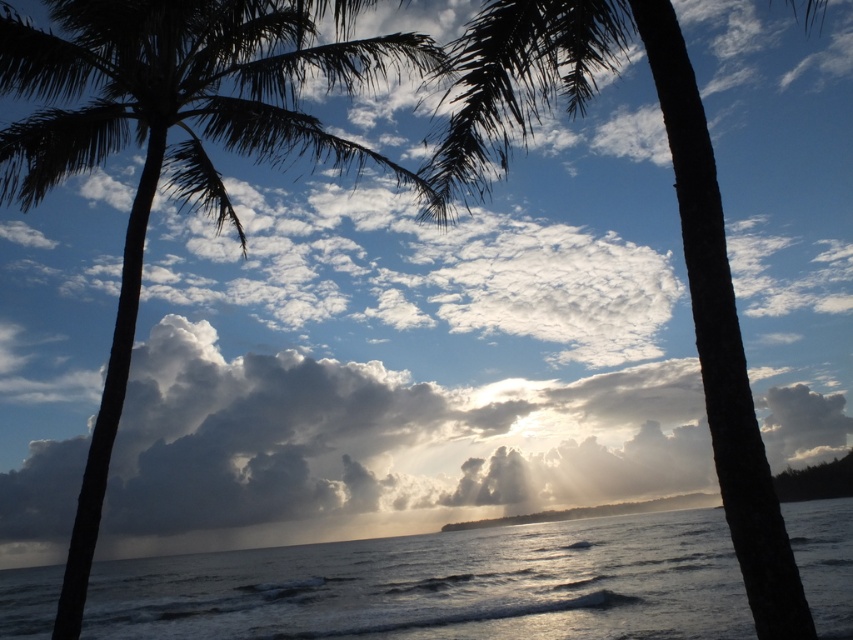
Between glistening silver water at center and dark brown bark palm tree at center, which one has less height?

With less height is glistening silver water at center.

Which is more to the right, glistening silver water at center or dark brown bark palm tree at center?

dark brown bark palm tree at center

This screenshot has width=853, height=640. What are the coordinates of `glistening silver water at center` in the screenshot? It's located at click(444, 586).

Locate an element on the screen. This screenshot has width=853, height=640. cloudy sky at center is located at coordinates (378, 442).

Consider the image. Does cloudy sky at center come behind dark brown bark palm tree at center?

Yes, it is.

Does point (656, 449) lie in front of point (781, 624)?

No, (656, 449) is behind (781, 624).

This screenshot has width=853, height=640. Identify the location of cloudy sky at center. (378, 442).

Which is below, glistening silver water at center or silky black palm tree at left?

Positioned lower is glistening silver water at center.

This screenshot has height=640, width=853. What are the coordinates of `glistening silver water at center` in the screenshot? It's located at (444, 586).

Locate an element on the screen. This screenshot has width=853, height=640. glistening silver water at center is located at coordinates (444, 586).